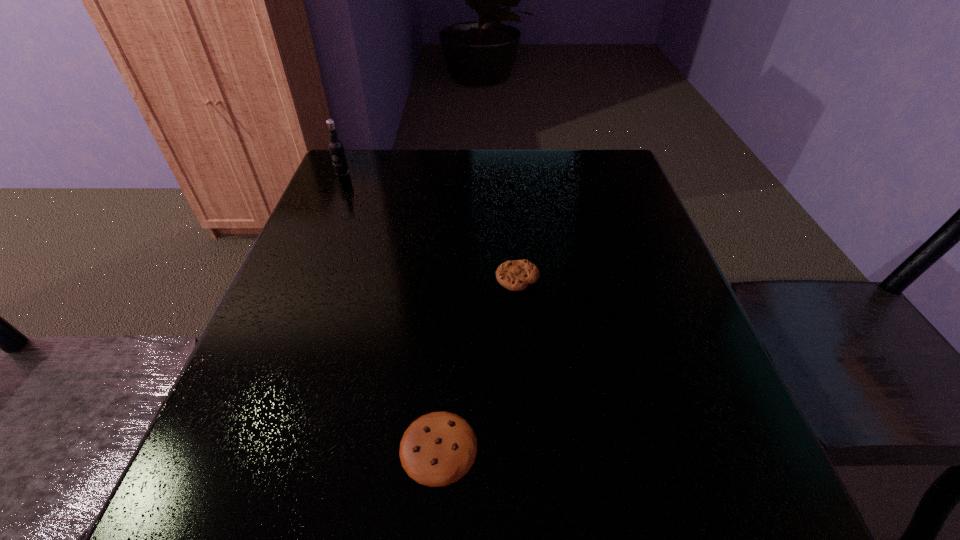
What are the coordinates of `the tallest object` in the screenshot? It's located at (336, 149).

What are the coordinates of `the farthest object` in the screenshot? It's located at (336, 149).

Identify the location of the rightmost object. (516, 275).

You are a GUI agent. You are given a task and a screenshot of the screen. Output one action in this format:
    pyautogui.click(x=<x>, y=<y>)
    Task: Click on the second tallest object
    Image resolution: width=960 pixels, height=540 pixels.
    Given the screenshot: What is the action you would take?
    pyautogui.click(x=516, y=275)

You are a GUI agent. You are given a task and a screenshot of the screen. Output one action in this format:
    pyautogui.click(x=<x>, y=<y>)
    Task: Click on the nearer cookie
    This screenshot has height=540, width=960.
    Given the screenshot: What is the action you would take?
    pyautogui.click(x=439, y=448)

At what (x,y) coordinates should I click in order to perform the action: click on the shorter cookie. Please return your answer as a coordinate pair (x, y). Looking at the image, I should click on (439, 448).

At what (x,y) coordinates should I click in order to perform the action: click on free space located on the label of the tallest object. Please return your answer as a coordinate pair (x, y). This screenshot has width=960, height=540. Looking at the image, I should click on (305, 260).

Locate an element on the screen. Image resolution: width=960 pixels, height=540 pixels. vacant space located on the back of the rightmost object is located at coordinates (511, 207).

Where is `vacant space located on the left of the nearer cookie`? The height and width of the screenshot is (540, 960). vacant space located on the left of the nearer cookie is located at coordinates (339, 447).

The height and width of the screenshot is (540, 960). I want to click on object at the far edge, so click(336, 149).